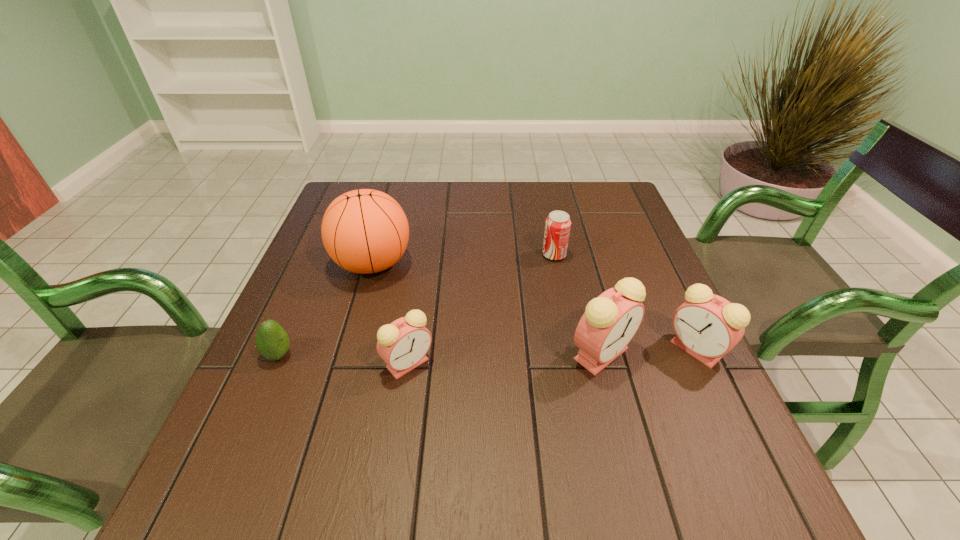
This screenshot has width=960, height=540. Identify the location of free space for an extra alarm_clock to achieve even spacing. (506, 359).